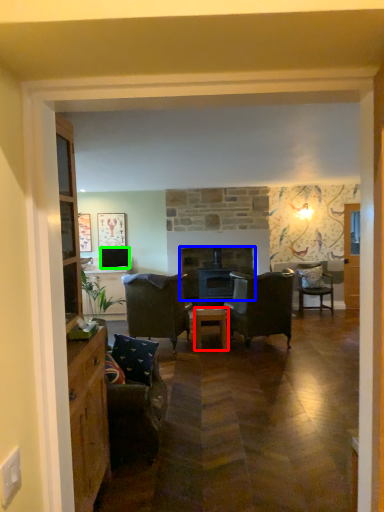
Question: Based on their relative distances, which object is farther from table (highlighted by a red box)? Choose from fireplace (highlighted by a blue box) and television (highlighted by a green box).

Choices:
 (A) fireplace
 (B) television

Answer: (B)